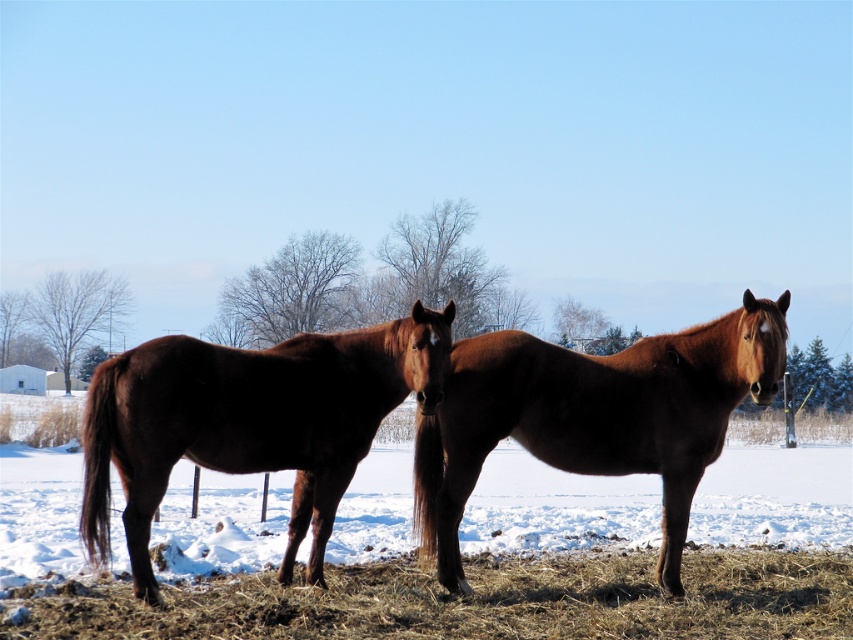
Question: Among these points, which one is farthest from the camera?

Choices:
 (A) pyautogui.click(x=485, y=573)
 (B) pyautogui.click(x=703, y=429)

Answer: (A)

Question: Which point is closer to the camera taking this photo?

Choices:
 (A) (44, 596)
 (B) (173, 376)

Answer: (B)

Question: Is brown glossy horse at left above brown glossy horse at center?

Choices:
 (A) yes
 (B) no

Answer: (B)

Question: Is dry straw at lower center thinner than brown glossy horse at left?

Choices:
 (A) no
 (B) yes

Answer: (B)

Question: Which object is closer to the camera taking this photo?

Choices:
 (A) brown glossy horse at center
 (B) dry straw at lower center

Answer: (B)

Question: Is brown glossy horse at left to the left of brown glossy horse at center from the viewer's perspective?

Choices:
 (A) yes
 (B) no

Answer: (A)